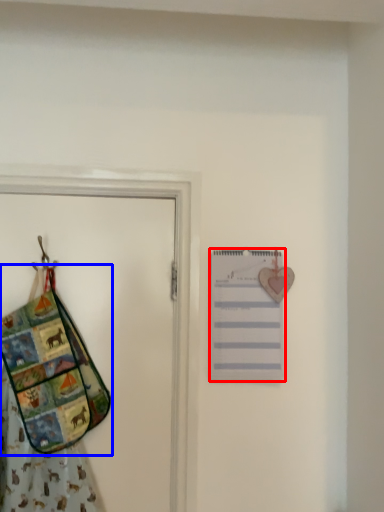
Question: Which point is further to the camera, list (highlighted by a red box) or handbag (highlighted by a blue box)?

Choices:
 (A) list
 (B) handbag

Answer: (A)